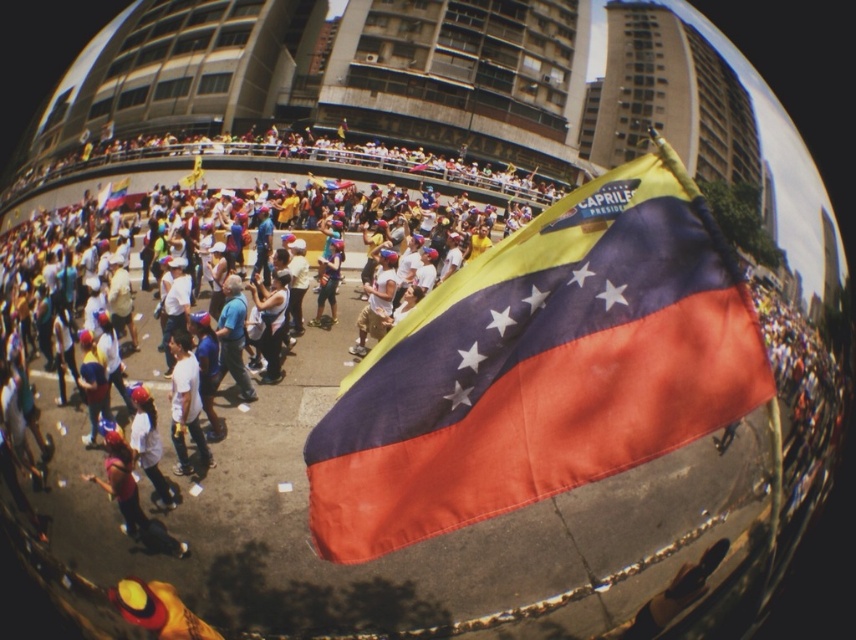
Between polyester flag at center and white matte shirt at center, which one appears on the right side from the viewer's perspective?

polyester flag at center

Based on the photo, does polyester flag at center appear on the left side of white matte shirt at center?

Incorrect, polyester flag at center is not on the left side of white matte shirt at center.

Describe the element at coordinates (542, 368) in the screenshot. The height and width of the screenshot is (640, 856). I see `polyester flag at center` at that location.

Where is `polyester flag at center`? This screenshot has width=856, height=640. polyester flag at center is located at coordinates (542, 368).

Does polyester flag at center appear on the left side of light brown fabric pants at center?

In fact, polyester flag at center is to the right of light brown fabric pants at center.

Is point (709, 342) positioned before point (393, 276)?

Yes, it is.

What are the coordinates of `polyester flag at center` in the screenshot? It's located at (542, 368).

Is white matte shirt at center positioned at the back of light brown fabric pants at center?

No, it is not.

Is point (200, 445) positioned after point (391, 291)?

No, it is not.

Does point (186, 460) lie in front of point (373, 292)?

Yes, it is in front of point (373, 292).

Where is `white matte shirt at center`? The width and height of the screenshot is (856, 640). white matte shirt at center is located at coordinates (185, 403).